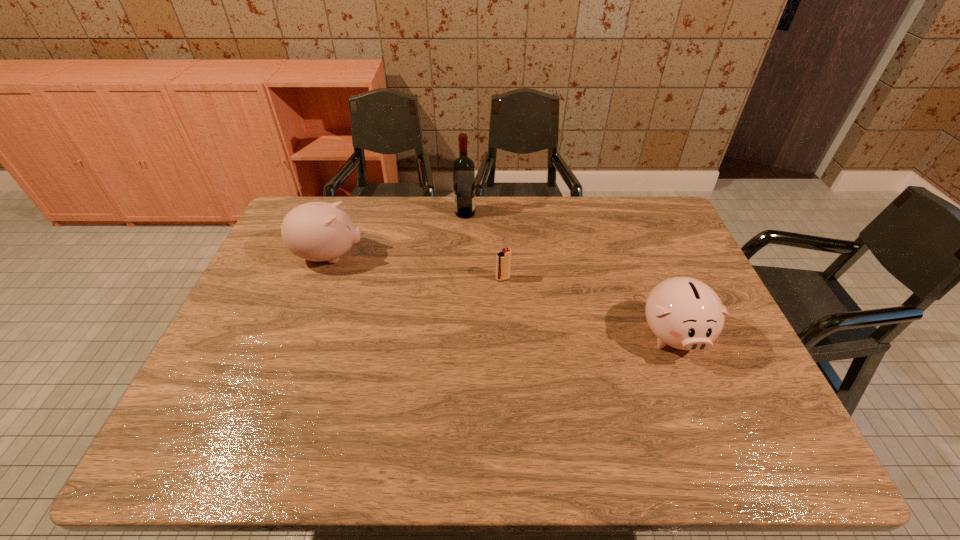
The height and width of the screenshot is (540, 960). In order to click on free location located on the front of the rightmost object in this screenshot , I will do `click(698, 398)`.

The width and height of the screenshot is (960, 540). Find the location of `blank area located on the front of the shortest object`. blank area located on the front of the shortest object is located at coordinates (504, 307).

Locate an element on the screen. object at the far edge is located at coordinates (463, 168).

I want to click on object situated at the left edge, so click(317, 231).

Where is `object that is positioned at the right edge`? The width and height of the screenshot is (960, 540). object that is positioned at the right edge is located at coordinates (685, 313).

Find the location of a particular element. The image size is (960, 540). vacant region at the far edge is located at coordinates (594, 225).

The image size is (960, 540). Find the location of `vacant space at the near edge of the desktop`. vacant space at the near edge of the desktop is located at coordinates (439, 462).

This screenshot has width=960, height=540. In order to click on free region at the left edge of the desktop in this screenshot , I will do `click(237, 371)`.

The height and width of the screenshot is (540, 960). I want to click on free spot at the far left corner of the desktop, so click(336, 201).

At what (x,y) coordinates should I click in order to perform the action: click on free space at the near left corner of the desktop. Please return your answer as a coordinate pair (x, y). Image resolution: width=960 pixels, height=540 pixels. Looking at the image, I should click on (194, 465).